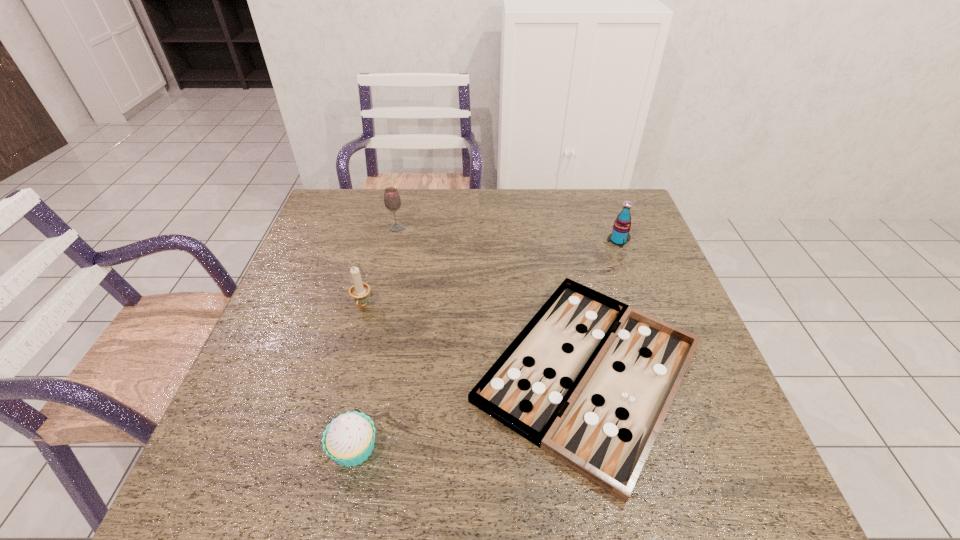
The image size is (960, 540). In order to click on vacant area that lies between the candle_holder and the soda in this screenshot , I will do `click(491, 273)`.

Image resolution: width=960 pixels, height=540 pixels. Identify the location of object that ranks as the third closest to the fourth tallest object. tap(392, 201).

The width and height of the screenshot is (960, 540). Find the location of `object that is the third closest to the candle_holder`. object that is the third closest to the candle_holder is located at coordinates (349, 439).

Where is `free space that satisfies the following two spatial constraints: 1. on the back side of the soda; 2. on the right side of the cupcake`? The image size is (960, 540). free space that satisfies the following two spatial constraints: 1. on the back side of the soda; 2. on the right side of the cupcake is located at coordinates (398, 241).

Where is `vacant region that satisfies the following two spatial constraints: 1. on the back side of the shortest object; 2. on the right side of the soda`? vacant region that satisfies the following two spatial constraints: 1. on the back side of the shortest object; 2. on the right side of the soda is located at coordinates (561, 241).